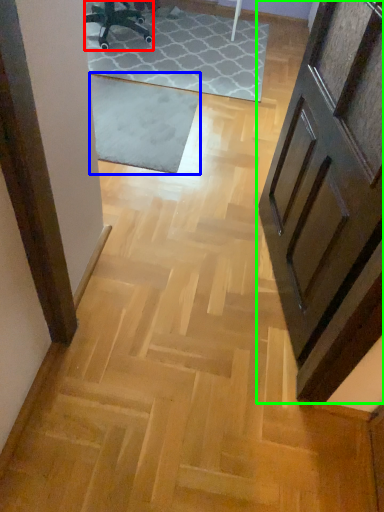
Question: Estimate the real-world distances between objects in this image. Which object is closer to chair (highlighted by a red box), mat (highlighted by a blue box) or door (highlighted by a green box)?

Choices:
 (A) mat
 (B) door

Answer: (A)